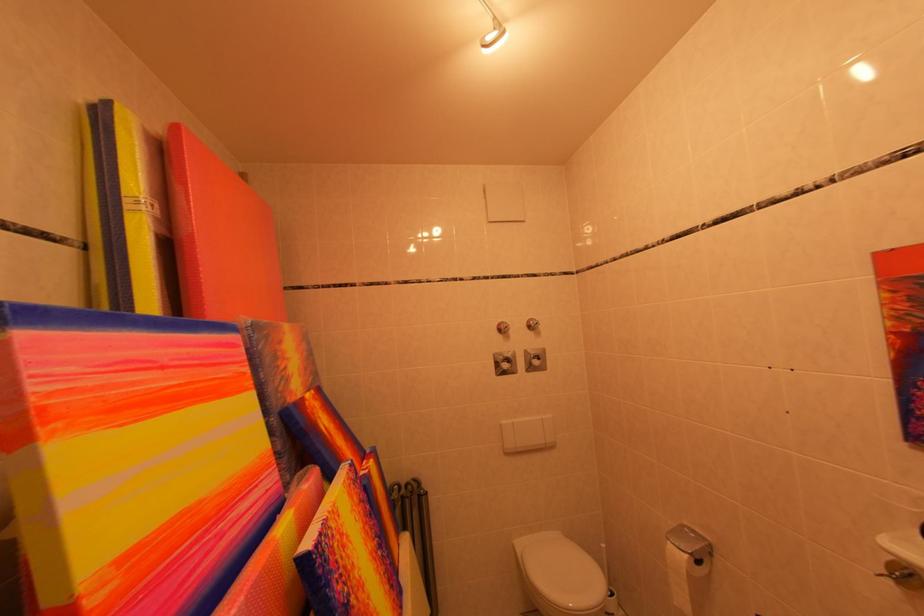
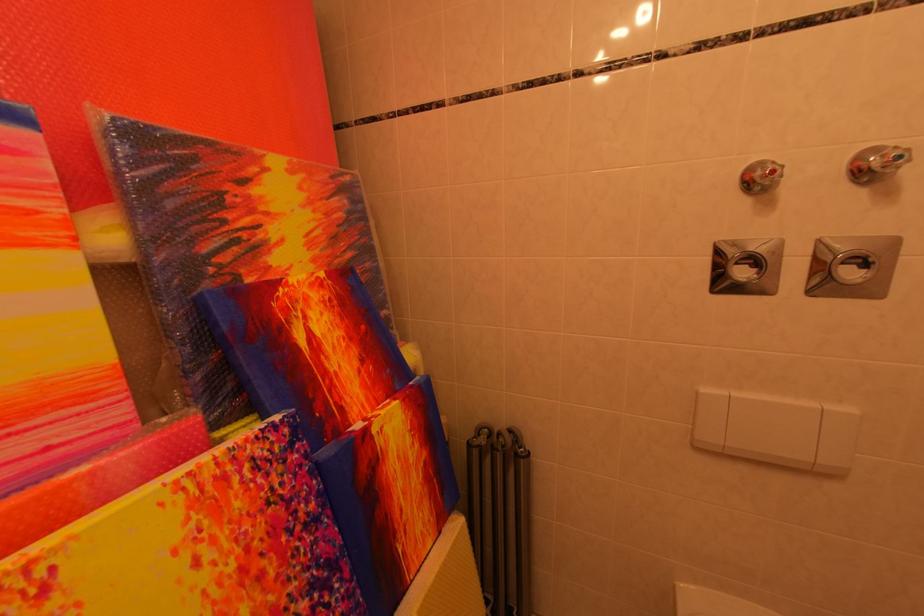
Where in the second image is the point corresponding to (x=516, y=331) from the first image?

(782, 176)